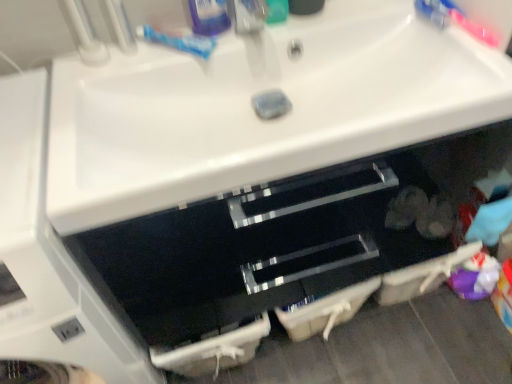
Where is `vacant space that is to the left of pink plastic toothbrush at upper right`? This screenshot has width=512, height=384. vacant space that is to the left of pink plastic toothbrush at upper right is located at coordinates (395, 28).